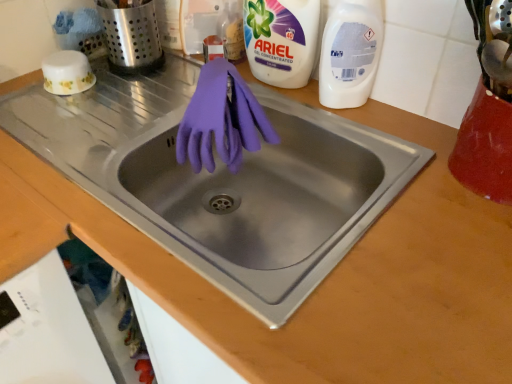
Question: Is white plastic bottle at upper right, which is the second cleaning product from left to right, in contact with brushed metal utensil holder at upper left?

Choices:
 (A) yes
 (B) no

Answer: (B)

Question: Can you confirm if white plastic bottle at upper right, which is the second cleaning product from left to right, is smaller than brushed metal utensil holder at upper left?

Choices:
 (A) no
 (B) yes

Answer: (B)

Question: Does white plastic bottle at upper right, marked as the first cleaning product in a right-to-left arrangement, have a lesser width compared to brushed metal utensil holder at upper left?

Choices:
 (A) yes
 (B) no

Answer: (A)

Question: Is white plastic bottle at upper right, marked as the first cleaning product in a right-to-left arrangement, closer to camera compared to brushed metal utensil holder at upper left?

Choices:
 (A) no
 (B) yes

Answer: (B)

Question: Is the depth of white plastic bottle at upper right, which is the second cleaning product from left to right, greater than that of brushed metal utensil holder at upper left?

Choices:
 (A) yes
 (B) no

Answer: (B)

Question: From the image's perspective, is white plastic bottle at upper right, which is the second cleaning product from left to right, over brushed metal utensil holder at upper left?

Choices:
 (A) yes
 (B) no

Answer: (B)

Question: Considering the relative sizes of white plastic dishwasher at lower left and white plastic bottle at upper right, which is the second cleaning product from left to right, in the image provided, is white plastic dishwasher at lower left taller than white plastic bottle at upper right, which is the second cleaning product from left to right,?

Choices:
 (A) yes
 (B) no

Answer: (A)

Question: From a real-world perspective, is white plastic dishwasher at lower left below white plastic bottle at upper right, which is the second cleaning product from left to right?

Choices:
 (A) no
 (B) yes

Answer: (B)

Question: Is white plastic dishwasher at lower left far from white plastic bottle at upper right, marked as the first cleaning product in a right-to-left arrangement?

Choices:
 (A) yes
 (B) no

Answer: (B)

Question: Is white plastic bottle at upper right, marked as the first cleaning product in a right-to-left arrangement, inside white plastic dishwasher at lower left?

Choices:
 (A) no
 (B) yes

Answer: (A)

Question: Is white plastic dishwasher at lower left in contact with white plastic bottle at upper right, marked as the first cleaning product in a right-to-left arrangement?

Choices:
 (A) no
 (B) yes

Answer: (A)

Question: From the image's perspective, is white plastic dishwasher at lower left on white plastic bottle at upper right, which is the second cleaning product from left to right?

Choices:
 (A) yes
 (B) no

Answer: (B)

Question: Is white plastic dishwasher at lower left at the back of matte purple gloves at center?

Choices:
 (A) yes
 (B) no

Answer: (B)